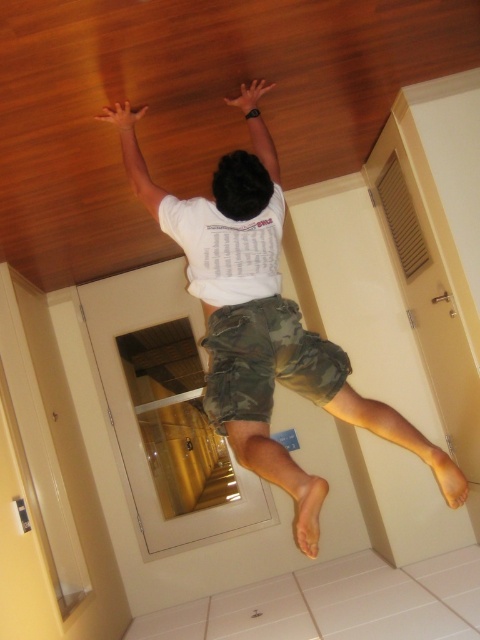
Question: Among these objects, which one is nearest to the camera?

Choices:
 (A) white matte t-shirt at upper center
 (B) white matte arm at upper center
 (C) matte white arm at upper center
 (D) camo fabric shorts at lower center

Answer: (A)

Question: Which object is positioned farthest from the matte white arm at upper center?

Choices:
 (A) white matte arm at upper center
 (B) camo fabric shorts at lower center

Answer: (B)

Question: Considering the relative positions of white matte t-shirt at upper center and white matte arm at upper center in the image provided, where is white matte t-shirt at upper center located with respect to white matte arm at upper center?

Choices:
 (A) right
 (B) left

Answer: (A)

Question: Among these objects, which one is farthest from the camera?

Choices:
 (A) matte white arm at upper center
 (B) white matte t-shirt at upper center
 (C) camo fabric shorts at lower center

Answer: (A)

Question: Where is white matte arm at upper center located in relation to matte white arm at upper center in the image?

Choices:
 (A) above
 (B) below

Answer: (B)

Question: Is camo fabric shorts at lower center positioned before white matte arm at upper center?

Choices:
 (A) no
 (B) yes

Answer: (B)